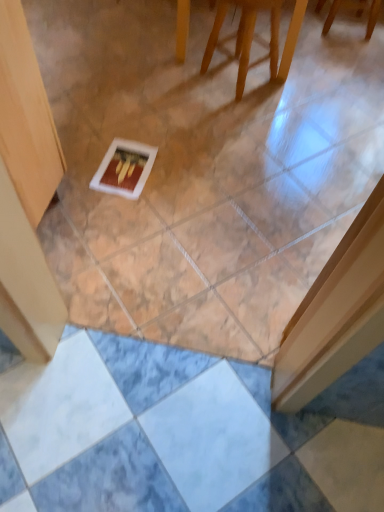
Image resolution: width=384 pixels, height=512 pixels. I want to click on free space above white matte postcard at center (from a real-world perspective), so (x=123, y=167).